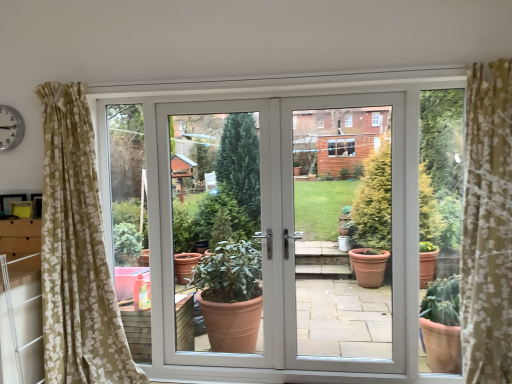
The height and width of the screenshot is (384, 512). I want to click on white glossy door at center, so click(x=277, y=232).

What is the approximate width of white glossy door at center?

The width of white glossy door at center is 3.13 inches.

Locate an element on the screen. This screenshot has height=384, width=512. white plastic screen door at center is located at coordinates (339, 225).

You are a GUI agent. You are given a task and a screenshot of the screen. Output one action in this format:
    pyautogui.click(x=<x>, y=<y>)
    Task: Click on the white plastic clock at upper left
    
    Given the screenshot: What is the action you would take?
    pyautogui.click(x=10, y=128)

Is white glossy door at center spatially inside white plastic clock at upper left, or outside of it?

white glossy door at center exists outside the volume of white plastic clock at upper left.

From the picture: Is white glossy door at center next to white plastic clock at upper left?

white glossy door at center and white plastic clock at upper left are clearly separated.

Considering the points (228, 117) and (8, 120), which point is behind, point (228, 117) or point (8, 120)?

The point (228, 117) is farther.

From a real-world perspective, is white plastic clock at upper left over white plastic screen door at center?

Indeed, from a real-world perspective, white plastic clock at upper left stands above white plastic screen door at center.

Considering the positions of objects white plastic clock at upper left and white plastic screen door at center in the image provided, who is more to the right, white plastic clock at upper left or white plastic screen door at center?

From the viewer's perspective, white plastic screen door at center appears more on the right side.

Is white plastic clock at upper left not near white plastic screen door at center?

That's right, there is a large distance between white plastic clock at upper left and white plastic screen door at center.

Considering the relative positions of white plastic screen door at center and white glossy door at center in the image provided, is white plastic screen door at center to the right of white glossy door at center from the viewer's perspective?

Indeed, white plastic screen door at center is positioned on the right side of white glossy door at center.

Would you consider white plastic screen door at center to be distant from white glossy door at center?

No.

Which point is more forward, (347, 286) or (345, 198)?

The point (345, 198) is in front.

Is white plastic screen door at center positioned behind white plastic clock at upper left?

That is False.

Is white plastic screen door at center next to white plastic clock at upper left?

No, white plastic screen door at center is not beside white plastic clock at upper left.

From the image's perspective, between white plastic screen door at center and white plastic clock at upper left, which one is located above?

From the image's view, white plastic clock at upper left is above.

Image resolution: width=512 pixels, height=384 pixels. Identify the location of screen door below the white plastic clock at upper left (from a real-world perspective). (339, 225).

Consider the image. From the image's perspective, is white glossy door at center on top of white plastic screen door at center?

No, from the image's perspective, white glossy door at center is not above white plastic screen door at center.

Considering the relative sizes of white glossy door at center and white plastic screen door at center in the image provided, is white glossy door at center smaller than white plastic screen door at center?

No.

Is white glossy door at center next to white plastic screen door at center?

They are not placed beside each other.

Is white glossy door at center at the right side of white plastic screen door at center?

In fact, white glossy door at center is to the left of white plastic screen door at center.

How many degrees apart are the facing directions of white plastic clock at upper left and white glossy door at center?

They differ by 0.199 degrees in their facing directions.

Is white plastic clock at upper left touching white glossy door at center?

There is a gap between white plastic clock at upper left and white glossy door at center.

Does white plastic clock at upper left come in front of white glossy door at center?

No, it is behind white glossy door at center.

In the image, there is a white glossy door at center. Where is `clock above it (from the image's perspective)`? This screenshot has height=384, width=512. clock above it (from the image's perspective) is located at coordinates (10, 128).

The width and height of the screenshot is (512, 384). Identify the location of screen door on the right of white plastic clock at upper left. (339, 225).

When comparing their distances from white plastic screen door at center, does white glossy door at center or white plastic clock at upper left seem further?

The object further to white plastic screen door at center is white plastic clock at upper left.

From the image, which object appears to be nearer to white glossy door at center, white plastic clock at upper left or white plastic screen door at center?

Based on the image, white plastic screen door at center appears to be nearer to white glossy door at center.

When comparing their distances from white plastic clock at upper left, does white glossy door at center or white plastic screen door at center seem closer?

Among the two, white glossy door at center is located nearer to white plastic clock at upper left.

Considering their positions, is white plastic screen door at center positioned closer to white glossy door at center than white plastic clock at upper left?

Among the two, white plastic screen door at center is located nearer to white glossy door at center.

When comparing their distances from white plastic clock at upper left, does white plastic screen door at center or white glossy door at center seem further?

white plastic screen door at center is further to white plastic clock at upper left.

Based on their spatial positions, is white plastic clock at upper left or white glossy door at center further from white plastic screen door at center?

white plastic clock at upper left.

I want to click on door between white plastic clock at upper left and white plastic screen door at center from left to right, so click(x=277, y=232).